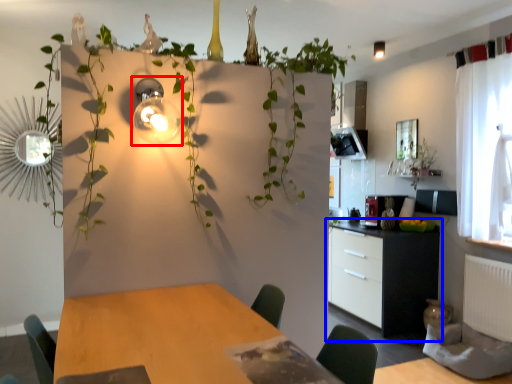
Question: Which of the following is the farthest to the observer, light fixture (highlighted by a red box) or cabinetry (highlighted by a blue box)?

Choices:
 (A) light fixture
 (B) cabinetry

Answer: (B)